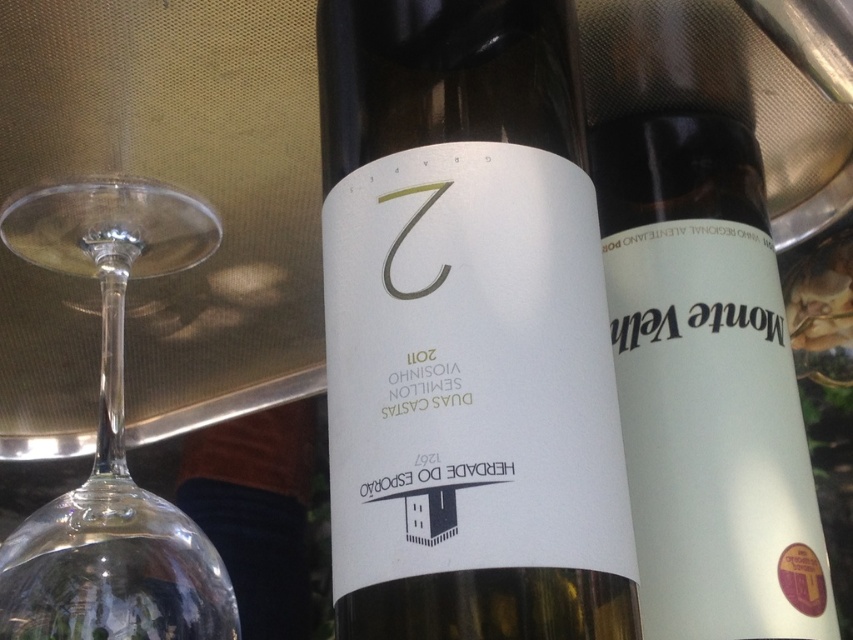
Question: Does white glass bottle at center have a smaller size compared to transparent glass wine glass at left?

Choices:
 (A) no
 (B) yes

Answer: (A)

Question: Can you confirm if white glass bottle at center is positioned below white matte bottle at center?

Choices:
 (A) yes
 (B) no

Answer: (B)

Question: Which point appears closest to the camera in this image?

Choices:
 (A) (627, 460)
 (B) (498, 221)
 (C) (68, 608)

Answer: (B)

Question: Is white glass bottle at center above white matte bottle at center?

Choices:
 (A) yes
 (B) no

Answer: (A)

Question: Among these points, which one is nearest to the camera?

Choices:
 (A) (532, 122)
 (B) (206, 612)
 (C) (692, 380)

Answer: (A)

Question: Which point appears farthest from the camera in this image?

Choices:
 (A) (782, 154)
 (B) (496, 326)
 (C) (140, 243)

Answer: (C)